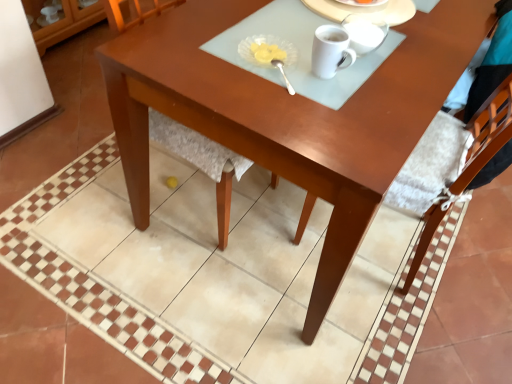
This screenshot has height=384, width=512. In order to click on vacant area that is in front of wooden chair at center in this screenshot , I will do `click(143, 296)`.